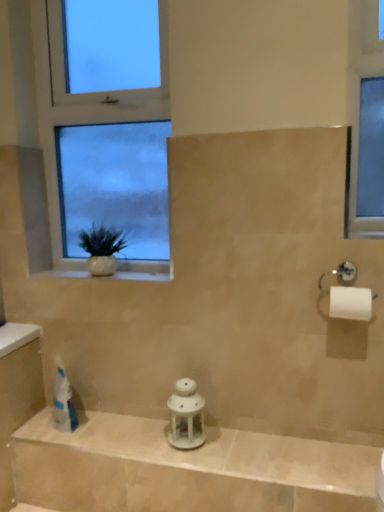
Identify the location of vacant space in front of white porcelain lantern at center. The height and width of the screenshot is (512, 384). (203, 457).